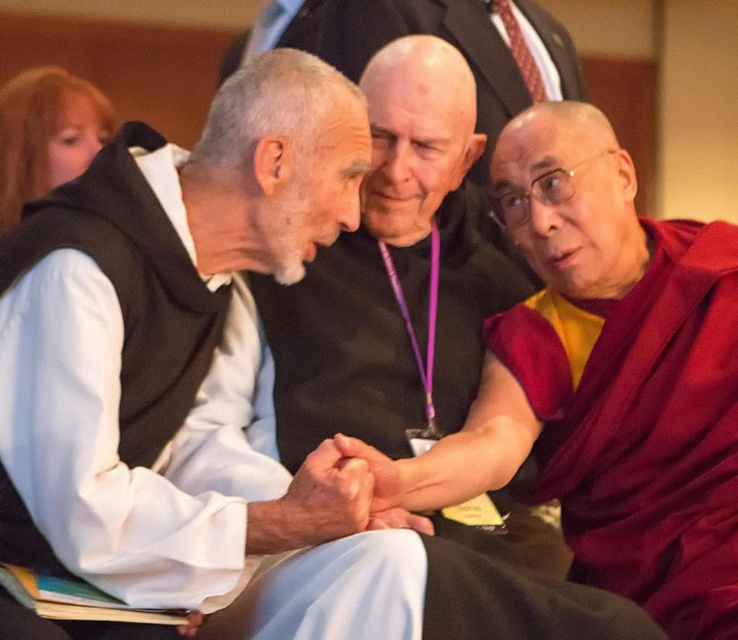
You are standing in the room and want to know the exact position of the maroon silk robe at right. Can you determine its coordinates based on the image?

The maroon silk robe at right is located at point (641, 426).

You are organizing a seating arrangement for a group photo and need to ensure that the maroon silk robe at center and the maroon silk robe at right are placed appropriately based on their sizes. Which robe should be placed in the front row to accommodate its size?

The maroon silk robe at center should be placed in the front row because it has a larger size compared to the maroon silk robe at right, ensuring there is enough space for it.

You are a photographer trying to capture a candid shot of the maroon silk robe at center and the white clothed man at center. The camera you are using has a minimum focus distance of 9 inches. Will you be able to focus on both subjects clearly without moving closer?

The maroon silk robe at center is 8.95 inches from the white clothed man at center. Since the distance between them is less than the camera minimum focus distance of 9 inches, the camera will not be able to focus on both subjects clearly without moving closer.